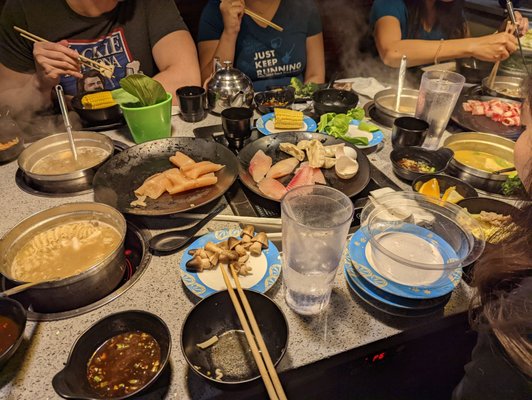
Identify the location of teapot handle. This screenshot has height=400, width=532. (213, 65).